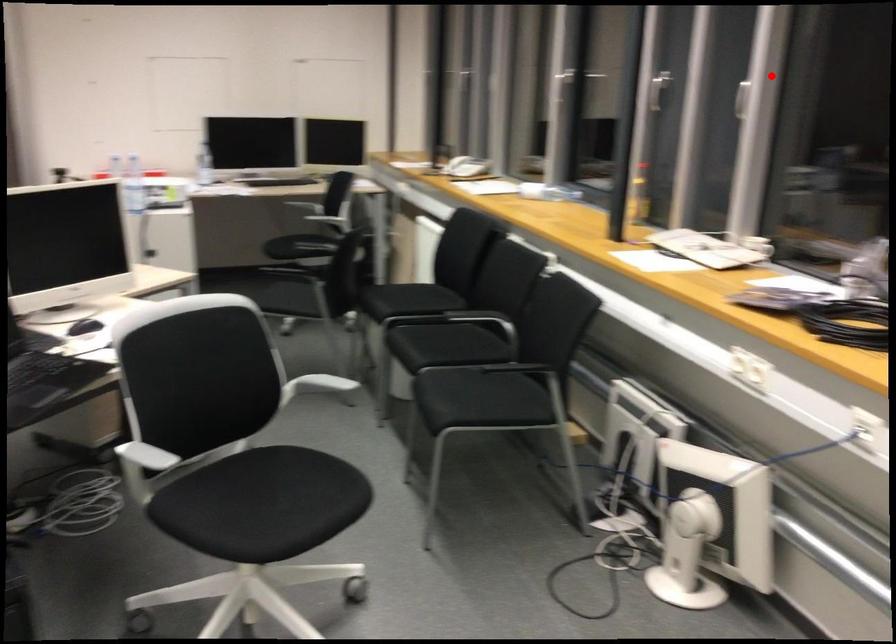
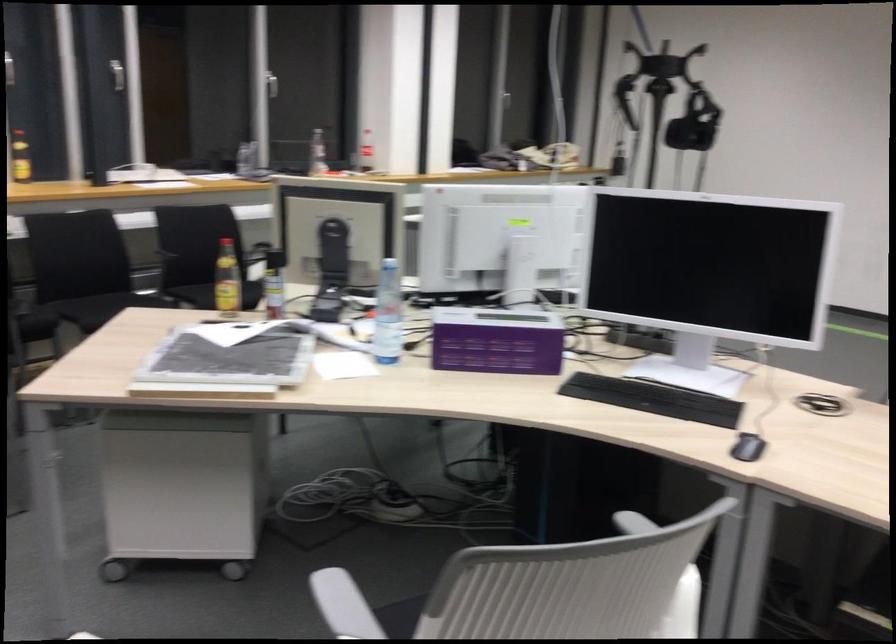
Locate, in the second image, the point that corresponds to the highlighted location in the first image.

(118, 79)